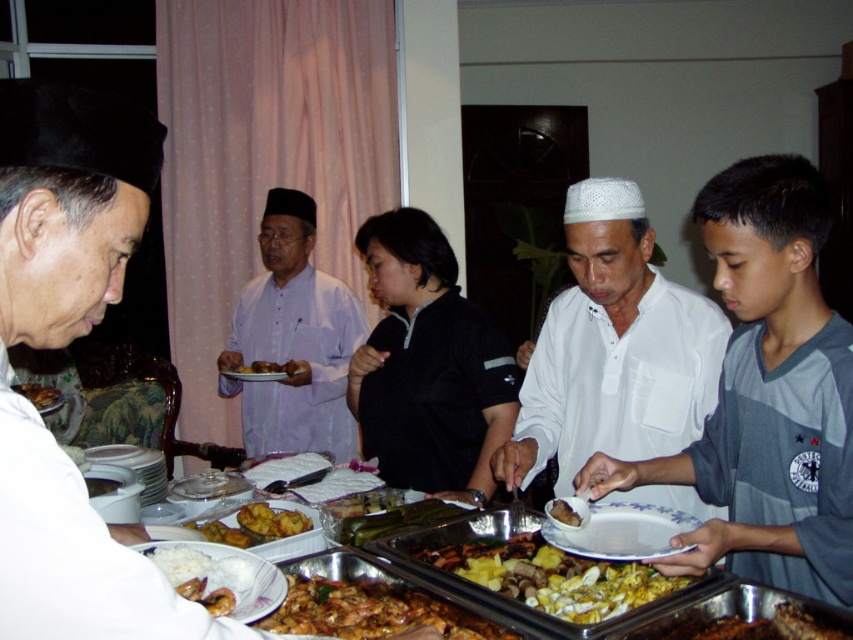
Question: Considering the real-world distances, which object is closest to the matte black hat at left?

Choices:
 (A) shiny silver plate at lower left
 (B) yellow/golden textured rice at lower center
 (C) brown matte rice at lower left

Answer: (A)

Question: Which point is farther from the camera taking this photo?

Choices:
 (A) (16, 385)
 (B) (815, 518)
 (C) (717, 628)

Answer: (A)

Question: Is golden brown crispy chicken at lower right thinner than golden crispy fried chicken at center?

Choices:
 (A) yes
 (B) no

Answer: (B)

Question: Where is white matte shirt at center located in relation to light purple cotton shirt at center in the image?

Choices:
 (A) above
 (B) below

Answer: (B)

Question: Which is nearer to the gray cotton shirt at center?

Choices:
 (A) golden crispy fried chicken at center
 (B) white matte shirt at center

Answer: (B)

Question: From the image, what is the correct spatial relationship of light purple cotton shirt at center in relation to yellow/golden textured rice at lower center?

Choices:
 (A) right
 (B) left

Answer: (B)